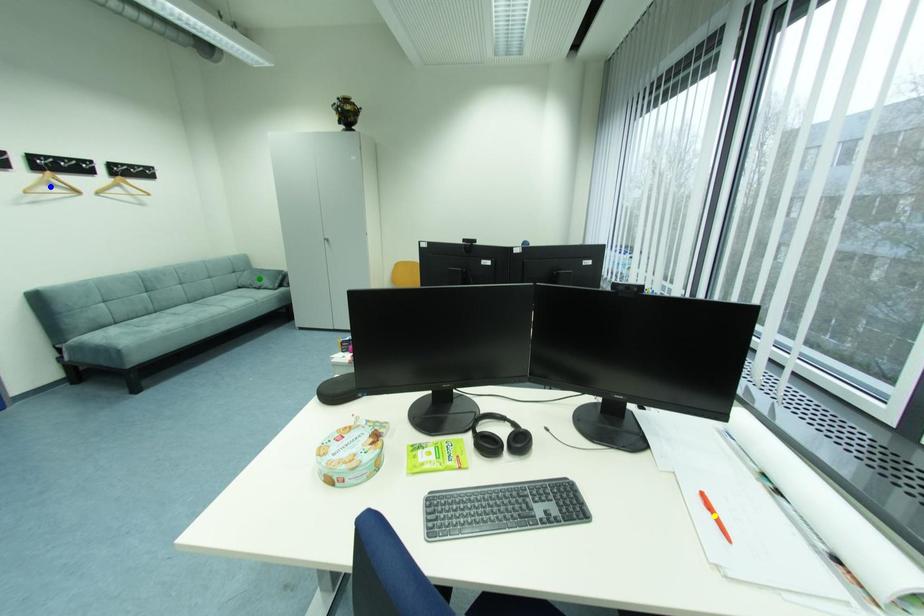
Order these from nearest to farthest:
A) green point
B) yellow point
C) blue point

yellow point
blue point
green point